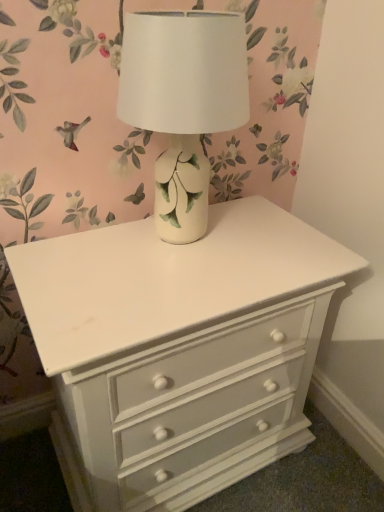
Locate an element on the screen. vacant space situated above white painted wood chest of drawers at center (from a real-world perspective) is located at coordinates (184, 251).